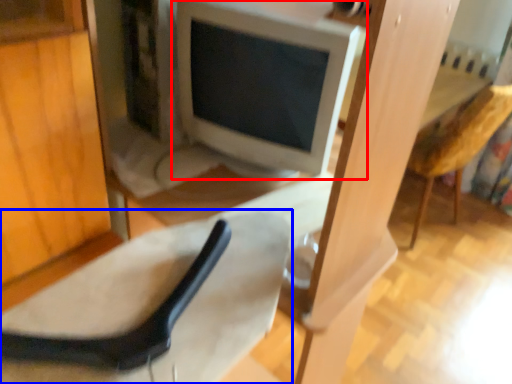
Question: Which point is further to the camera, computer monitor (highlighted by a red box) or chair (highlighted by a blue box)?

Choices:
 (A) computer monitor
 (B) chair

Answer: (A)